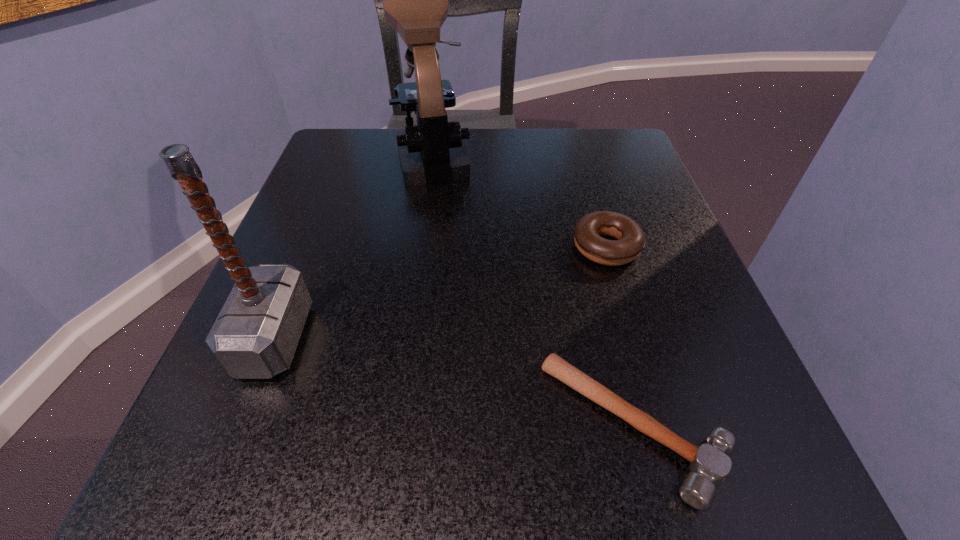
What are the coordinates of `free area in between the doughnut and the microscope` in the screenshot? It's located at (520, 201).

You are a GUI agent. You are given a task and a screenshot of the screen. Output one action in this format:
    pyautogui.click(x=<x>, y=<y>)
    Task: Click on the free point between the leftmost object and the third nearest object
    This screenshot has width=960, height=540.
    Given the screenshot: What is the action you would take?
    pyautogui.click(x=441, y=293)

Image resolution: width=960 pixels, height=540 pixels. In order to click on vacant region between the second shortest object and the microscope in this screenshot , I will do `click(520, 201)`.

Find the location of `vacant area between the second farthest object and the leftmost object`. vacant area between the second farthest object and the leftmost object is located at coordinates (441, 293).

Locate an element on the screen. free space between the leftmost object and the shorter hammer is located at coordinates (454, 382).

This screenshot has height=540, width=960. In order to click on free space between the shorter hammer and the second shortest object in this screenshot , I will do `click(620, 337)`.

Locate an element on the screen. The width and height of the screenshot is (960, 540). object that ranks as the second closest to the leftmost object is located at coordinates (709, 465).

The width and height of the screenshot is (960, 540). In order to click on object that stands as the second closest to the second farthest object in this screenshot , I will do `click(415, 0)`.

Where is `free space in the image that satisfies the following two spatial constraints: 1. on the front side of the shortest object; 2. on the right side of the microscope`? The height and width of the screenshot is (540, 960). free space in the image that satisfies the following two spatial constraints: 1. on the front side of the shortest object; 2. on the right side of the microscope is located at coordinates (396, 427).

The height and width of the screenshot is (540, 960). I want to click on free space that satisfies the following two spatial constraints: 1. on the front side of the right hammer; 2. on the left side of the microscope, so click(396, 427).